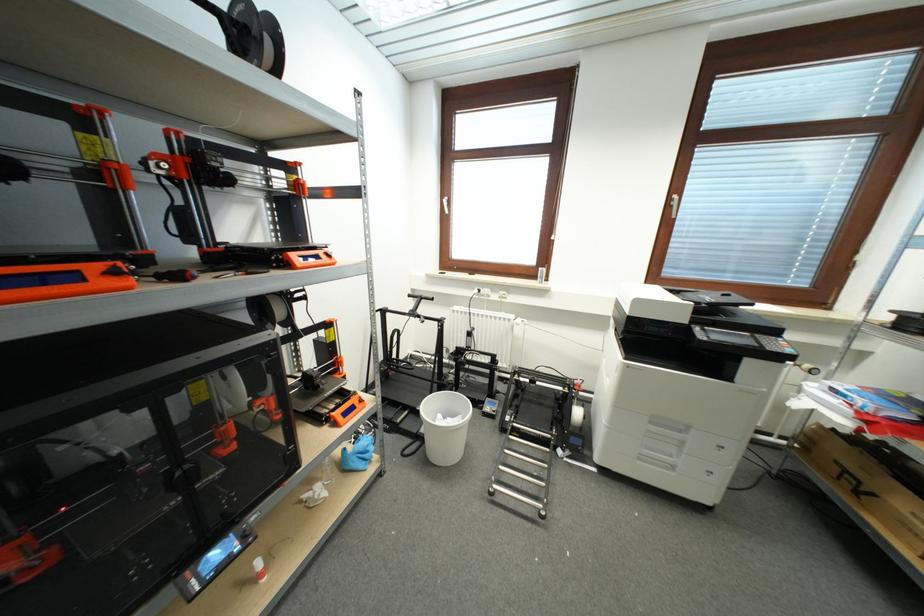
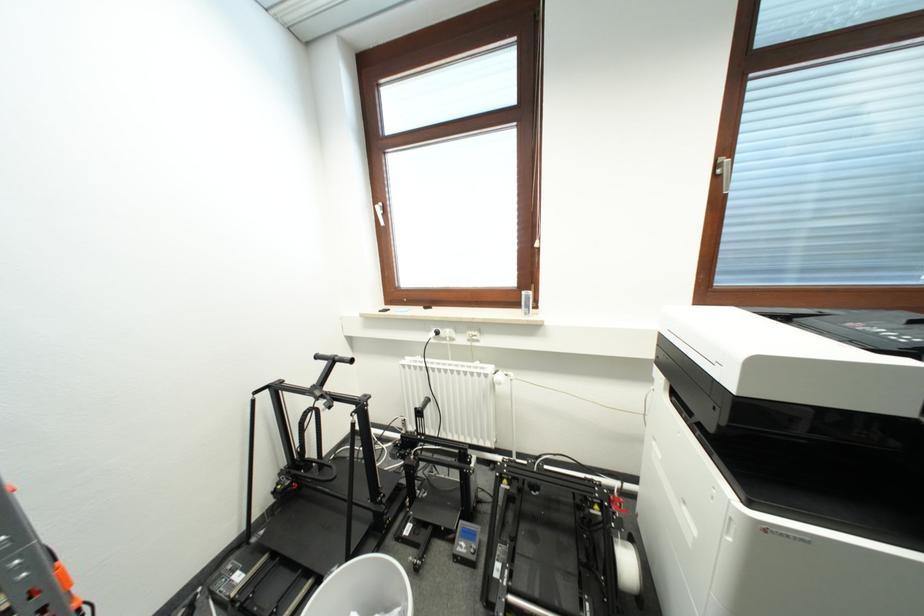
Find the pixel in the second image that matches pixel 415 299 in the first image.

(322, 360)